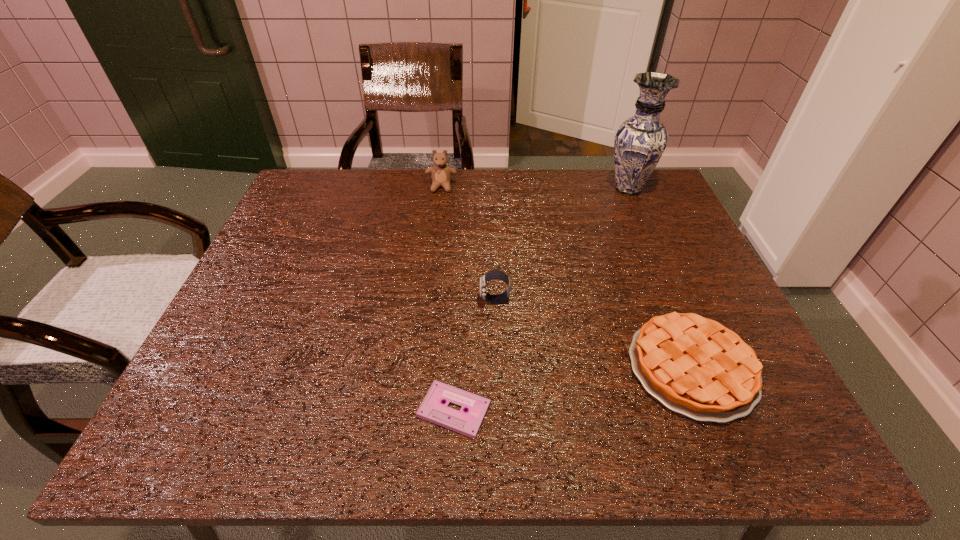
The width and height of the screenshot is (960, 540). I want to click on the tallest object, so click(x=640, y=141).

Where is `teddy bear`? teddy bear is located at coordinates (440, 173).

Locate an element on the screen. This screenshot has height=540, width=960. the third tallest object is located at coordinates (494, 274).

In order to click on watch in this screenshot , I will do (494, 274).

Find the location of a particular element. The image size is (960, 540). pie is located at coordinates (695, 366).

This screenshot has height=540, width=960. Identify the location of videotape. (432, 408).

At what (x,y) coordinates should I click in order to perform the action: click on vacant area located on the front of the tallest object. Please return your answer as a coordinate pair (x, y). Looking at the image, I should click on (644, 226).

Find the location of a particular element. free spot located on the front-facing side of the teddy bear is located at coordinates (433, 261).

Image resolution: width=960 pixels, height=540 pixels. What are the coordinates of `blank space located on the face of the watch` in the screenshot? It's located at (383, 300).

This screenshot has height=540, width=960. Identify the location of vacant space located on the face of the watch. (335, 300).